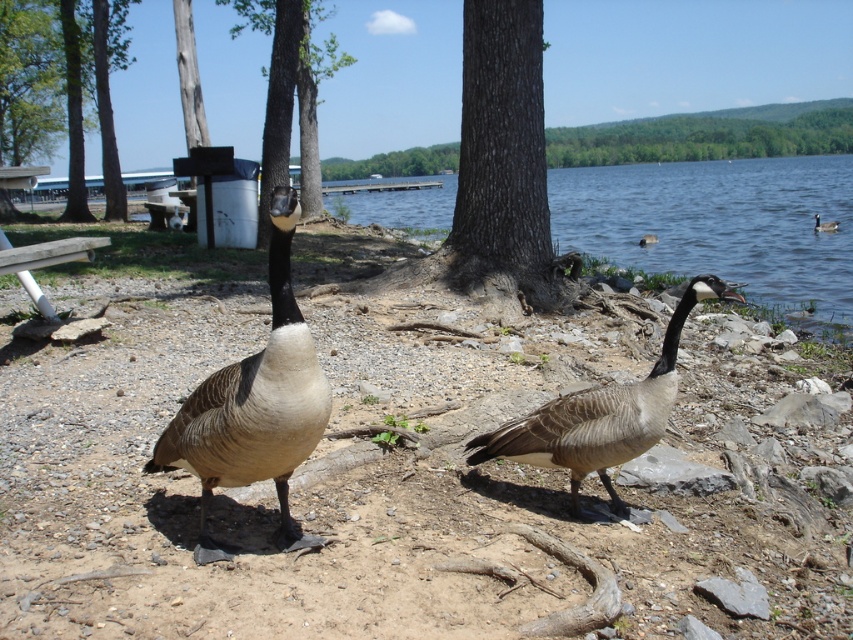
Question: Can you confirm if clear water at center is positioned to the left of brown feathered goose at center?

Choices:
 (A) no
 (B) yes

Answer: (A)

Question: Which object appears farthest from the camera in this image?

Choices:
 (A) clear water at center
 (B) brown matte goose at center
 (C) brown textured dirt at center
 (D) brown rough bark tree at center

Answer: (A)

Question: Does brown feathered goose at center appear under brushed metal trash can at upper left?

Choices:
 (A) no
 (B) yes

Answer: (B)

Question: Is brown textured dirt at center wider than brown bark tree at upper center?

Choices:
 (A) no
 (B) yes

Answer: (B)

Question: Which of the following is the closest to the observer?

Choices:
 (A) (109, 65)
 (B) (639, 451)
 (C) (776, 198)

Answer: (B)

Question: Which of the following is the closest to the observer?

Choices:
 (A) (315, 22)
 (B) (556, 444)
 (C) (828, 225)
 (D) (115, 168)

Answer: (B)